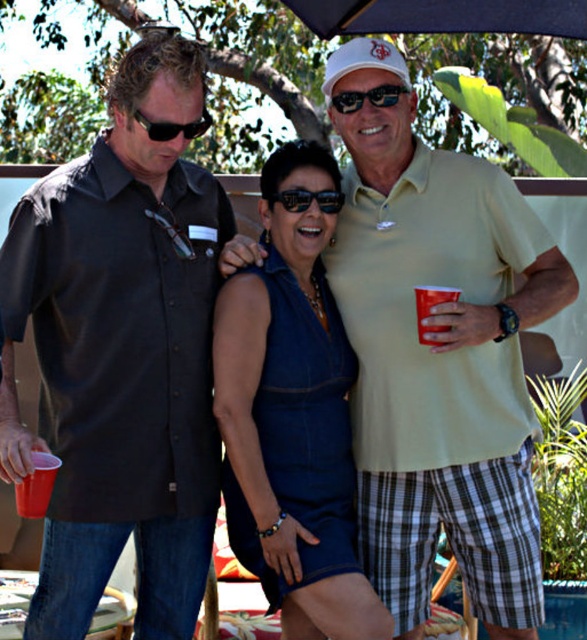
Question: Considering the relative positions of red plastic cup at center and black plastic sunglasses at upper left in the image provided, where is red plastic cup at center located with respect to black plastic sunglasses at upper left?

Choices:
 (A) below
 (B) above

Answer: (A)

Question: Can you confirm if black matte shirt at left is positioned to the right of matte plastic cup at left?

Choices:
 (A) no
 (B) yes

Answer: (B)

Question: Which point appears farthest from the camera in this image?

Choices:
 (A) (56, 308)
 (B) (356, 93)
 (C) (193, 129)
 (D) (335, 212)

Answer: (D)

Question: Does matte plastic cup at left have a lesser width compared to black plastic sunglasses at center?

Choices:
 (A) no
 (B) yes

Answer: (B)

Question: Which point is closer to the camera?

Choices:
 (A) (325, 196)
 (B) (383, 88)
 (C) (95, 259)

Answer: (C)

Question: Among these objects, which one is farthest from the camera?

Choices:
 (A) black plastic sunglasses at upper left
 (B) black plastic sunglasses at center

Answer: (B)